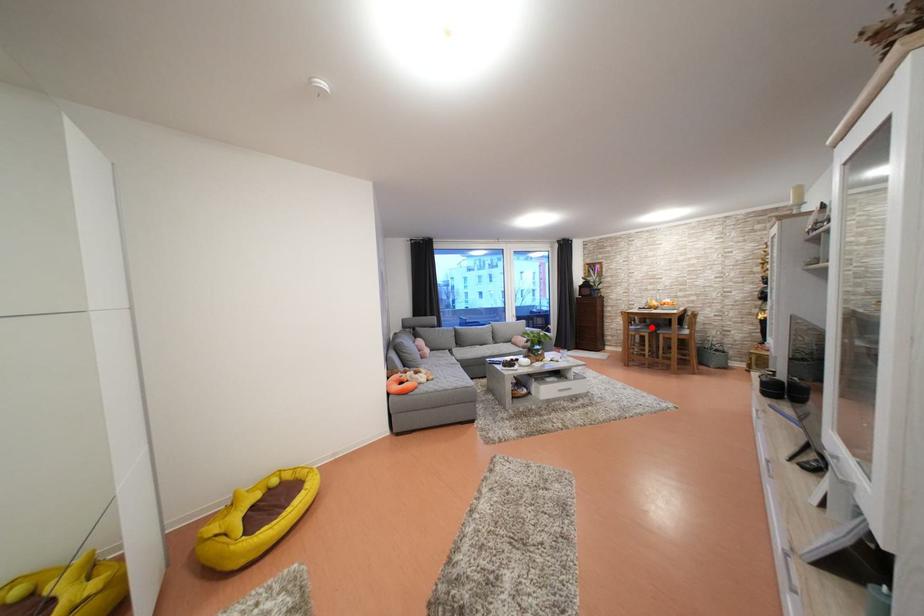
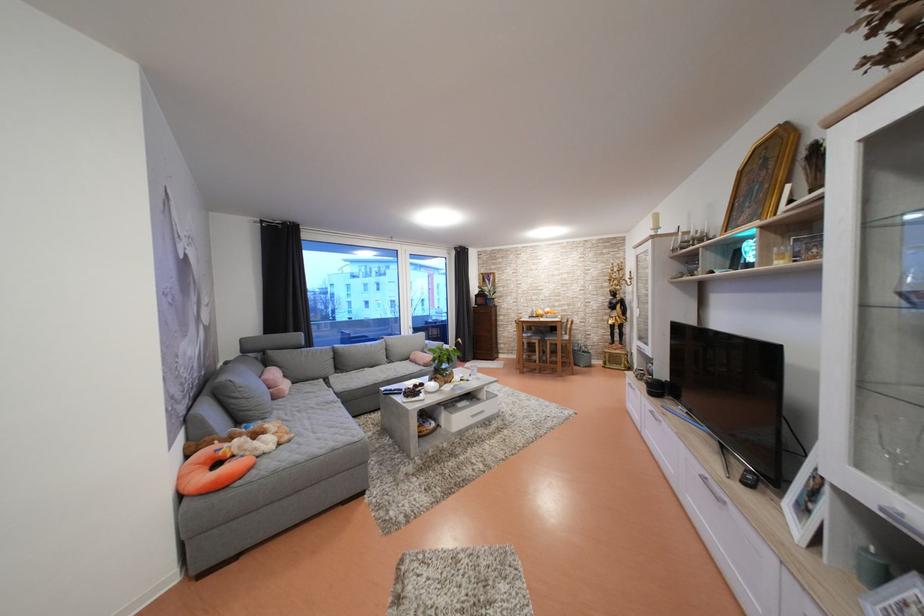
Question: I am providing you with two images of the same scene from different viewpoints. Image1 has a red point marked. In image2, the corresponding 3D location appears at what relative position? Reply with the corresponding letter.

Choices:
 (A) Closer
 (B) Farther

Answer: (B)